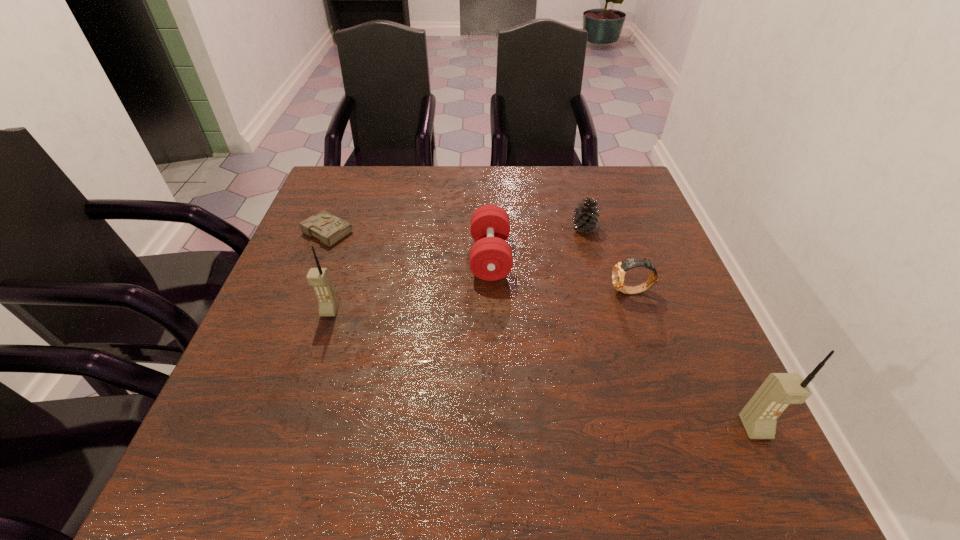
I want to click on the shorter cellular telephone, so click(319, 278).

At what (x,y) coordinates should I click in order to perform the action: click on the fifth shortest object. Please return your answer as a coordinate pair (x, y). This screenshot has width=960, height=540. Looking at the image, I should click on (319, 278).

Identify the location of the tallest object. (759, 417).

You are a GUI agent. You are given a task and a screenshot of the screen. Output one action in this format:
    pyautogui.click(x=<x>, y=<y>)
    Task: Click on the rightmost object
    The width and height of the screenshot is (960, 540).
    Given the screenshot: What is the action you would take?
    pyautogui.click(x=759, y=417)

At what (x,y) coordinates should I click in order to perform the action: click on pinecone. Please return your answer as a coordinate pair (x, y). The height and width of the screenshot is (540, 960). Looking at the image, I should click on (585, 218).

Locate an element on the screen. This screenshot has height=540, width=960. diary is located at coordinates (329, 229).

This screenshot has height=540, width=960. What are the coordinates of `dumbbell` in the screenshot? It's located at (491, 259).

In order to click on watch in this screenshot , I will do `click(618, 273)`.

Image resolution: width=960 pixels, height=540 pixels. I want to click on vacant space located 0.070m on the front of the left cellular telephone, where the keypad is located, so tap(319, 344).

Locate an element on the screen. The height and width of the screenshot is (540, 960). free space located 0.110m on the front of the pinecone is located at coordinates pyautogui.click(x=594, y=265).